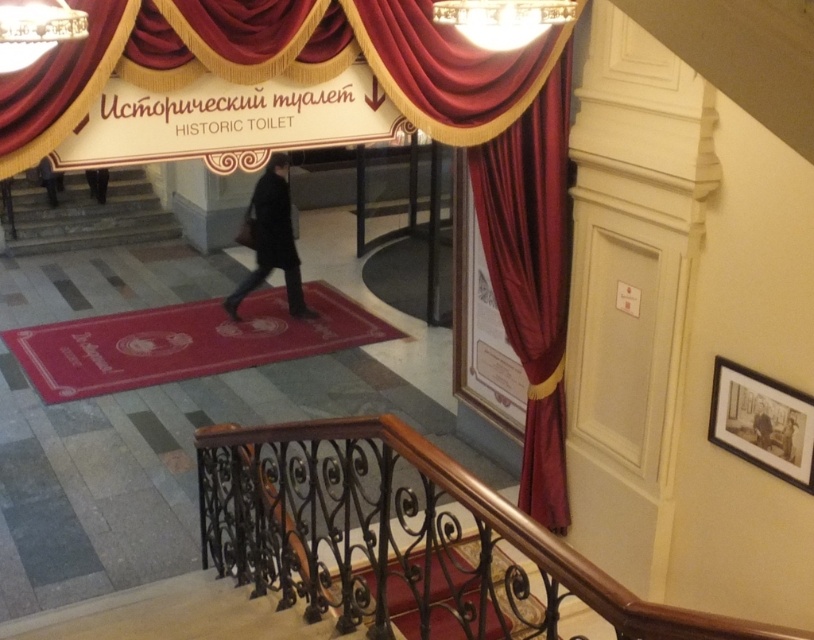
The image size is (814, 640). What do you see at coordinates (85, 214) in the screenshot?
I see `concrete stairs at left` at bounding box center [85, 214].

Does point (22, 252) come farther from viewer compared to point (252, 227)?

That is True.

Find the location of `concrete stairs at left`. concrete stairs at left is located at coordinates click(x=85, y=214).

Between velvet red curtain at upper left and dark gray fabric coat at lower left, which one has more height?

velvet red curtain at upper left is taller.

Is velvet red curtain at upper left to the left of dark gray fabric coat at lower left from the viewer's perspective?

Incorrect, velvet red curtain at upper left is not on the left side of dark gray fabric coat at lower left.

Does point (50, 97) come farther from viewer compared to point (58, 182)?

No, (50, 97) is in front of (58, 182).

Where is `velvet red curtain at upper left`? velvet red curtain at upper left is located at coordinates (60, 84).

How distant is concrete stairs at left from black leather coat at center?

The distance of concrete stairs at left from black leather coat at center is 78.12 centimeters.

Who is taller, concrete stairs at left or black leather coat at center?

Standing taller between the two is concrete stairs at left.

Describe the element at coordinates (85, 214) in the screenshot. I see `concrete stairs at left` at that location.

This screenshot has height=640, width=814. Find the location of `concrete stairs at left`. concrete stairs at left is located at coordinates click(85, 214).